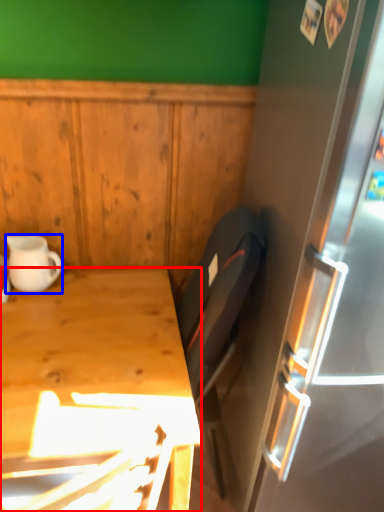
Question: Among these objects, which one is nearest to the camera, desk (highlighted by a red box) or coffee cup (highlighted by a blue box)?

Choices:
 (A) desk
 (B) coffee cup

Answer: (A)